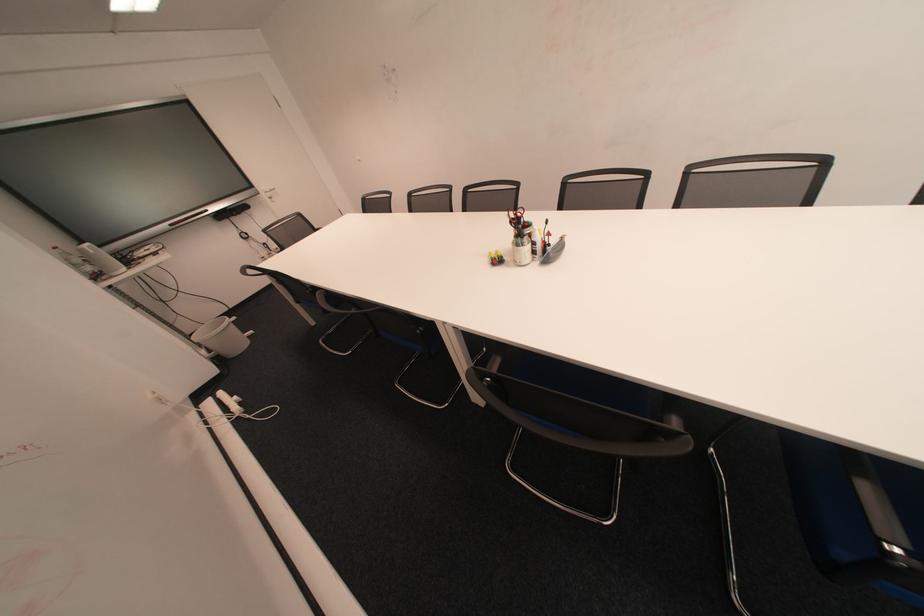
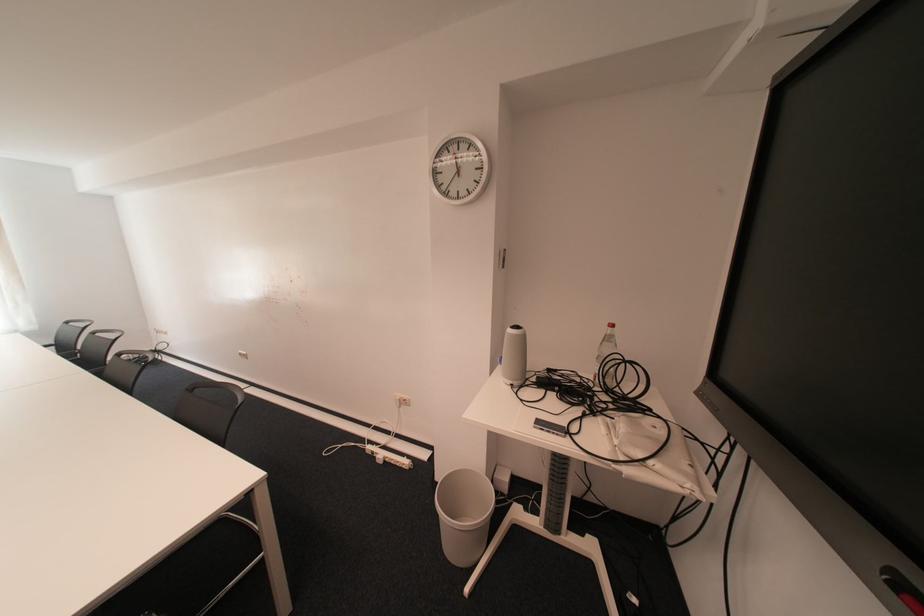
Where in the second image is the point corresponding to the point at 137,270 from the first image?

(520, 383)